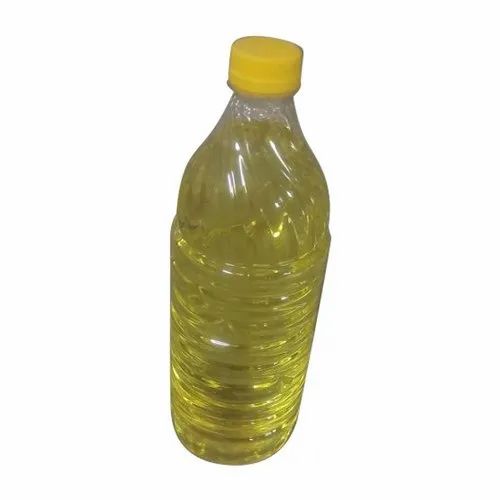
The height and width of the screenshot is (500, 500). Find the location of `empty space to right of bottle`. empty space to right of bottle is located at coordinates (378, 390), (381, 124), (400, 275).